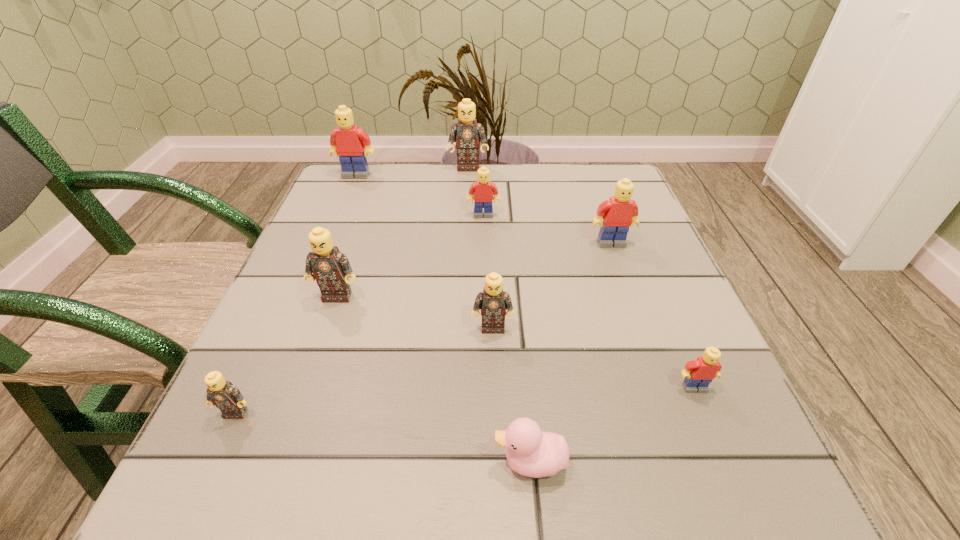
Locate an element on the screen. This screenshot has width=960, height=540. free space that satisfies the following two spatial constraints: 1. on the front-facing side of the third smallest yellow Lego; 2. on the front-facing side of the duckling is located at coordinates (690, 462).

Identify the location of vacant space that satisfies the following two spatial constraints: 1. on the front-facing side of the third farthest yellow Lego; 2. on the front-facing side of the duckling. The image size is (960, 540). (690, 462).